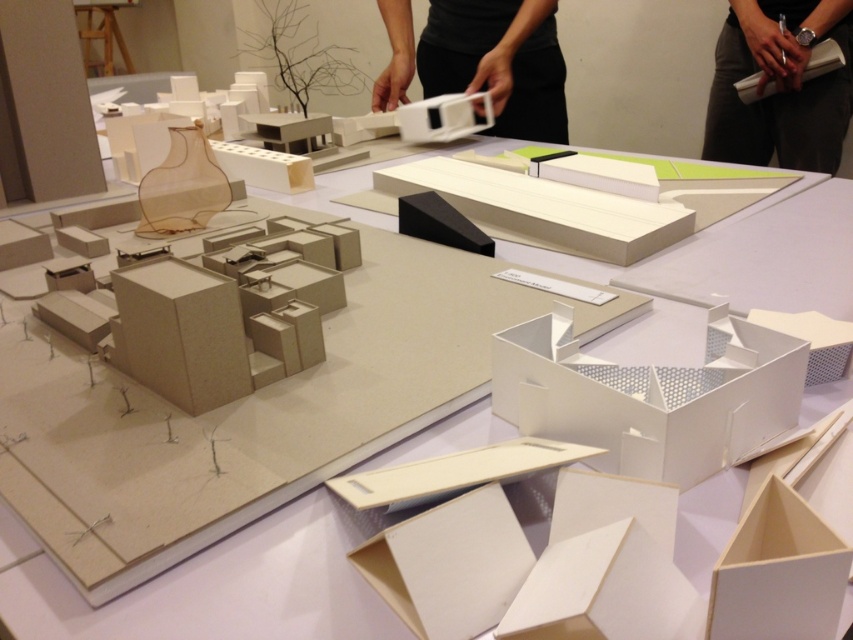
You are an architect examining the architectural model. You notice the black fabric at upper right and the matte white plastic model at upper center. Which object is closer to you in the scene?

The black fabric at upper right is closer to you than the matte white plastic model at upper center because it is further to the viewer.

You are an architect reviewing the architectural model. You notice the black fabric at upper right and the matte white plastic model at upper center. Which object is positioned further to the east in the scene?

The black fabric at upper right is positioned to the right of the matte white plastic model at upper center, so it is further to the east in the scene.